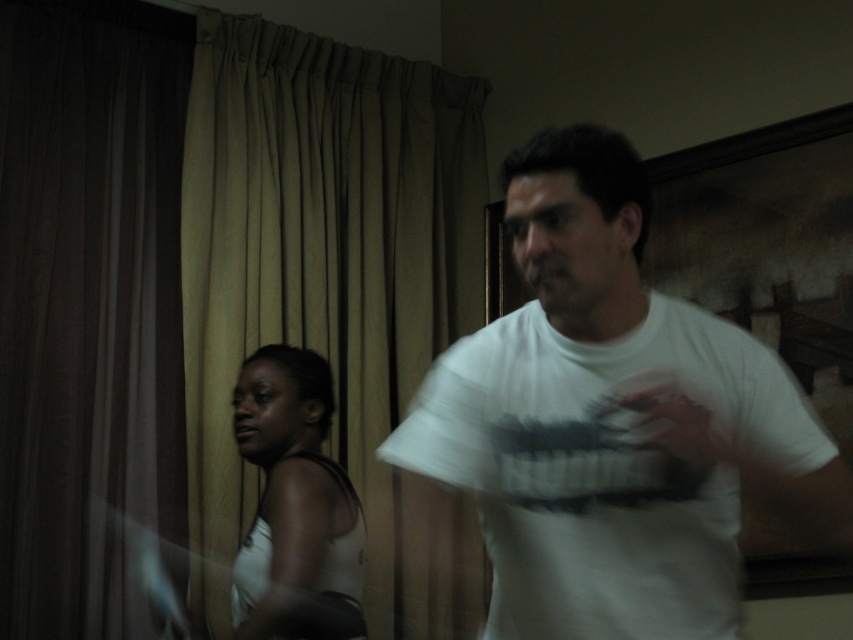
You are standing in the room and see two points marked in the image. Which point, point (639,454) or point (265,618), is nearer to you?

Point (639,454) is closer to the viewer than point (265,618).

You are standing in the room where the image was taken. There is a beige fabric curtain at upper center marked by point [328,276]. If you want to walk towards that point, which direction should you move relative to your current position?

The point [328,276] marks the beige fabric curtain at upper center. To walk towards it, you should move forward and slightly to the right since the curtain is located in the upper central area of the room.